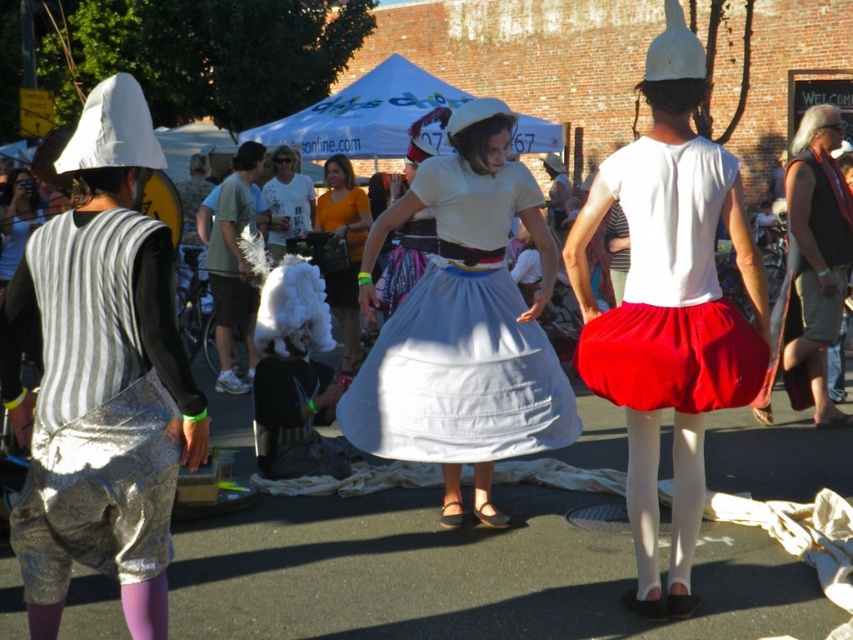
Question: Is matte white skirt at center wider than matte red skirt at center?

Choices:
 (A) no
 (B) yes

Answer: (A)

Question: Which point appears farthest from the camera in this image?

Choices:
 (A) (328, 228)
 (B) (660, 282)

Answer: (A)

Question: Which object is the farthest from the white fluffy wig at center?

Choices:
 (A) white cotton skirt at center
 (B) matte white skirt at center
 (C) orange t-shirt at center
 (D) black leather tank top at right

Answer: (B)

Question: Is black leather tank top at right wider than orange t-shirt at center?

Choices:
 (A) no
 (B) yes

Answer: (B)

Question: Does matte white skirt at center have a greater width compared to white cotton skirt at center?

Choices:
 (A) yes
 (B) no

Answer: (B)

Question: Which of the following is the closest to the observer?

Choices:
 (A) (402, 394)
 (B) (250, 156)

Answer: (A)